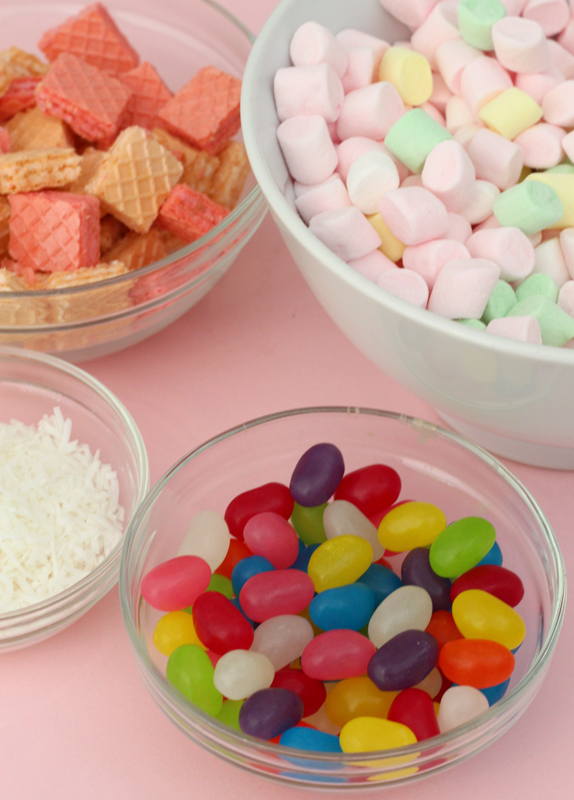
Identify the location of pink surface. The width and height of the screenshot is (574, 800). (112, 742), (187, 377), (530, 729).